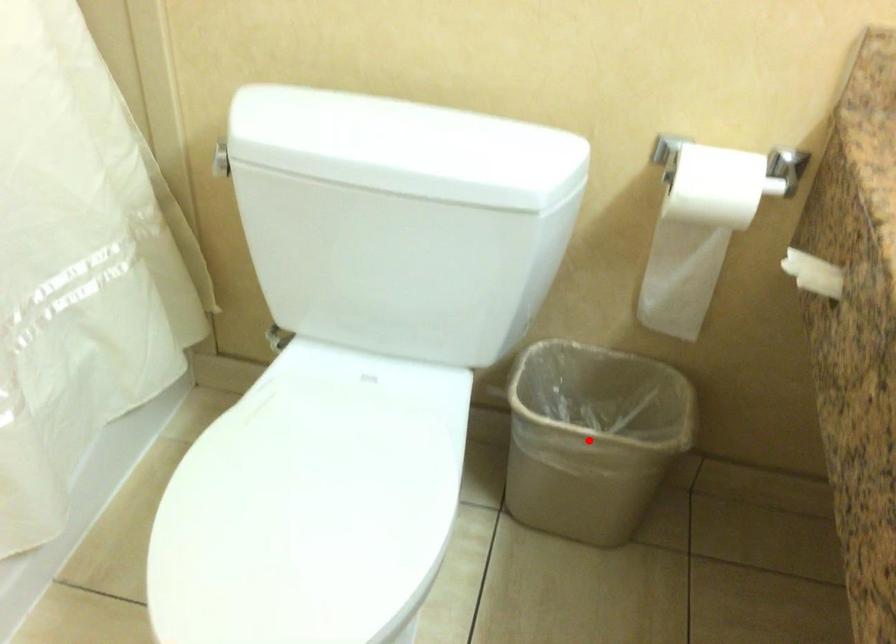
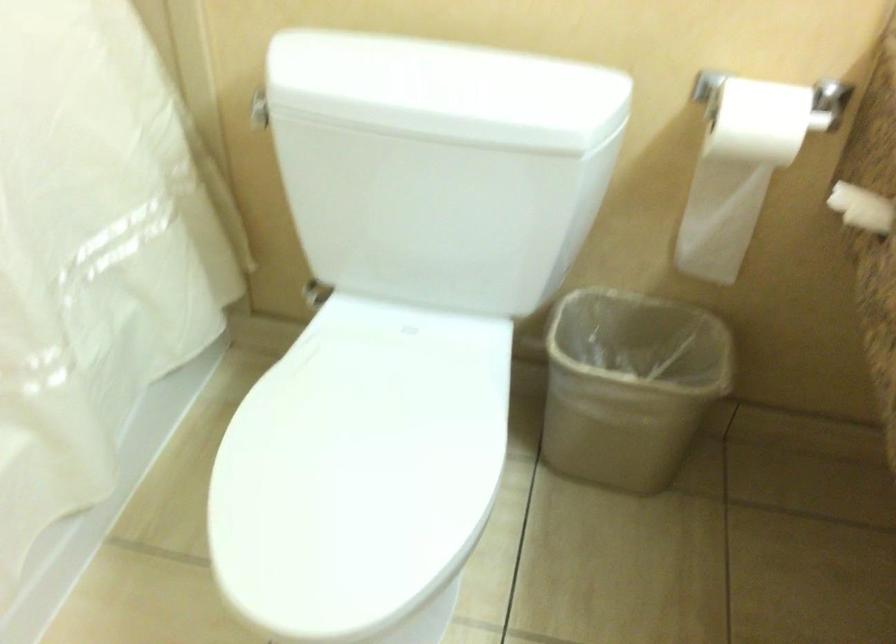
Locate, in the second image, the point that corresponds to the highlighted location in the first image.

(629, 384)